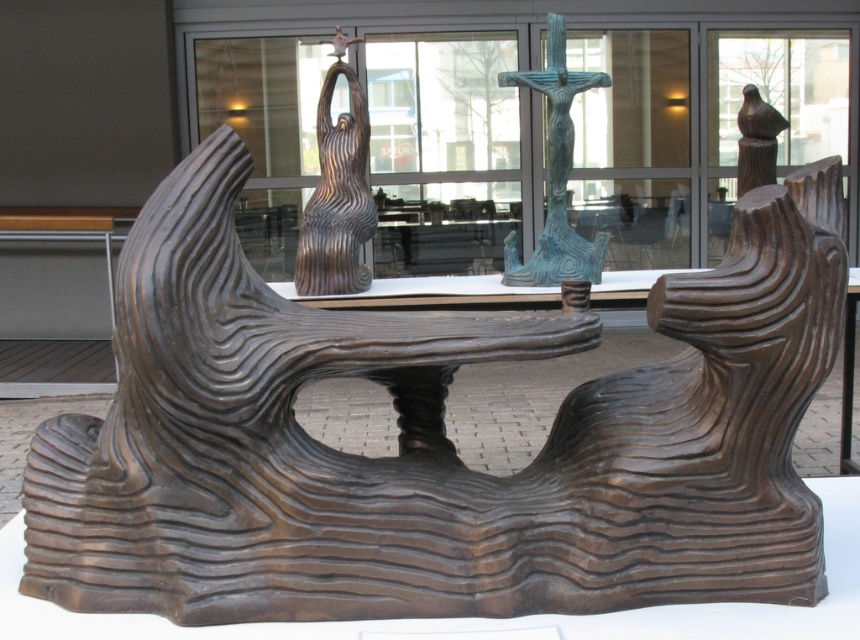
Which is above, wooden sculpture at center or green patina metal crucifix at center?

Positioned higher is wooden sculpture at center.

Which is in front, point (354, 109) or point (551, 140)?

Point (354, 109) is in front.

Find the location of a particular element. The height and width of the screenshot is (640, 860). wooden sculpture at center is located at coordinates (336, 192).